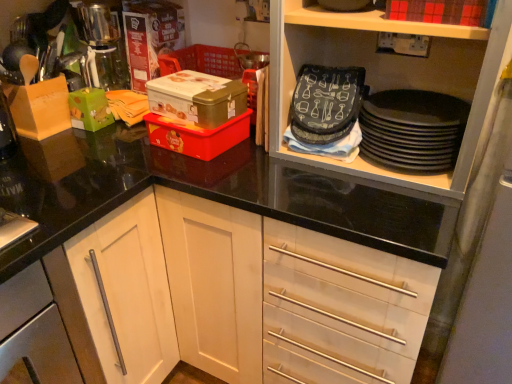
Question: Which direction should I rotate to look at metallic gold box at center, which is counted as the second box, starting from the left, — up or down?

Choices:
 (A) down
 (B) up

Answer: (B)

Question: Would you say red matte box at upper right, which is counted as the 4th box, starting from the left, is part of black matte plates at upper right's contents?

Choices:
 (A) no
 (B) yes

Answer: (A)

Question: Is black matte plates at upper right positioned before red matte box at upper right, which is the first box in right-to-left order?

Choices:
 (A) yes
 (B) no

Answer: (B)

Question: Is black matte plates at upper right taller than red matte box at upper right, which is the first box in right-to-left order?

Choices:
 (A) no
 (B) yes

Answer: (B)

Question: From a real-world perspective, does black matte plates at upper right sit lower than red matte box at upper right, which is counted as the 4th box, starting from the left?

Choices:
 (A) no
 (B) yes

Answer: (B)

Question: Would you say black matte plates at upper right is outside red matte box at upper right, which is the first box in right-to-left order?

Choices:
 (A) no
 (B) yes

Answer: (B)

Question: From a real-world perspective, is black matte plates at upper right over red matte box at upper right, which is the first box in right-to-left order?

Choices:
 (A) no
 (B) yes

Answer: (A)

Question: Is green matte box at left, which is the first box in left-to-right order, wider than red matte box at upper right, which is counted as the 4th box, starting from the left?

Choices:
 (A) no
 (B) yes

Answer: (A)

Question: Considering the relative sizes of green matte box at left, which is the first box in left-to-right order, and red matte box at upper right, which is the first box in right-to-left order, in the image provided, is green matte box at left, which is the first box in left-to-right order, thinner than red matte box at upper right, which is the first box in right-to-left order,?

Choices:
 (A) yes
 (B) no

Answer: (A)

Question: Is red matte box at upper right, which is counted as the 4th box, starting from the left, inside green matte box at left, which ranks as the fourth box in right-to-left order?

Choices:
 (A) no
 (B) yes

Answer: (A)

Question: Is green matte box at left, which ranks as the fourth box in right-to-left order, outside of red matte box at upper right, which is counted as the 4th box, starting from the left?

Choices:
 (A) yes
 (B) no

Answer: (A)

Question: Is green matte box at left, which ranks as the fourth box in right-to-left order, next to red matte box at upper right, which is counted as the 4th box, starting from the left, and touching it?

Choices:
 (A) yes
 (B) no

Answer: (B)

Question: From the image's perspective, is silver metallic cabinet handle at lower left beneath black matte plates at upper right?

Choices:
 (A) no
 (B) yes

Answer: (B)